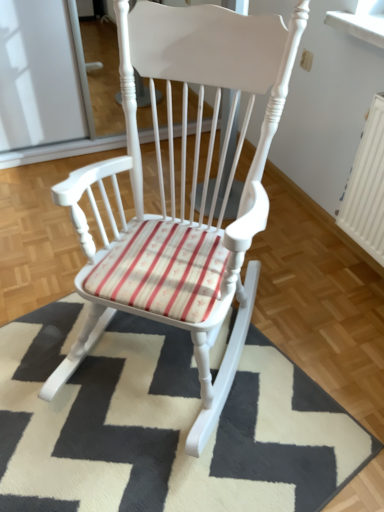
I want to click on free space above white textured mat at center (from a real-world perspective), so click(x=154, y=404).